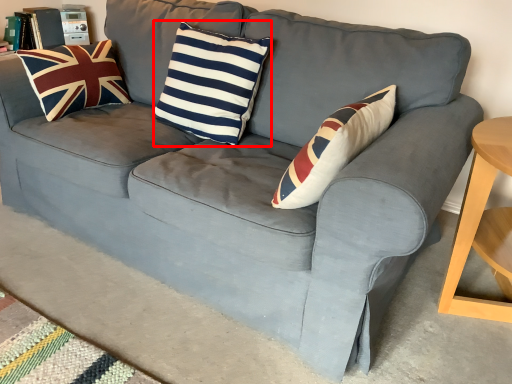
Question: Where is pillow (annotated by the red box) located in relation to pillow in the image?

Choices:
 (A) right
 (B) left

Answer: (A)